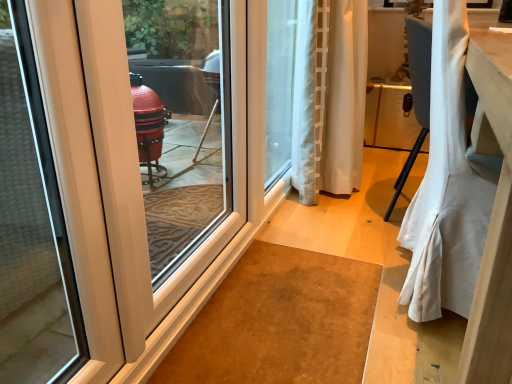
Question: Is white sheer curtain at center, marked as the first curtain in a back-to-front arrangement, taller or shorter than white glossy door at left?

Choices:
 (A) short
 (B) tall

Answer: (B)

Question: Does point [x=349, y=182] appear closer or farther from the camera than point [x=186, y=158]?

Choices:
 (A) closer
 (B) farther

Answer: (A)

Question: Which object is the closest to the white glossy door at left?

Choices:
 (A) white sheer curtain at center, marked as the first curtain in a back-to-front arrangement
 (B) carpet at center
 (C) white fabric curtain at right, which ranks as the 1th curtain in front-to-back order

Answer: (B)

Question: Estimate the real-world distances between objects in this image. Which object is farther from the white fabric curtain at right, the 2th curtain when ordered from back to front?

Choices:
 (A) carpet at center
 (B) white sheer curtain at center, marked as the first curtain in a back-to-front arrangement
 (C) white glossy door at left

Answer: (C)